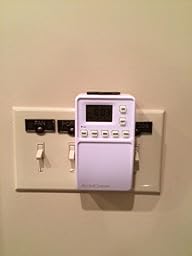
Where is `light switch`? The height and width of the screenshot is (256, 192). light switch is located at coordinates (40, 155), (73, 155), (137, 158).